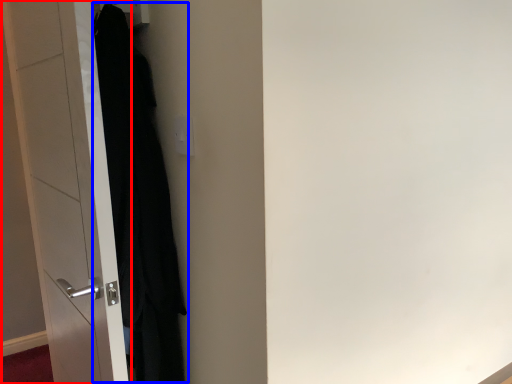
Question: Which object appears closest to the camera in this image, door (highlighted by a red box) or clothing (highlighted by a blue box)?

Choices:
 (A) door
 (B) clothing

Answer: (A)